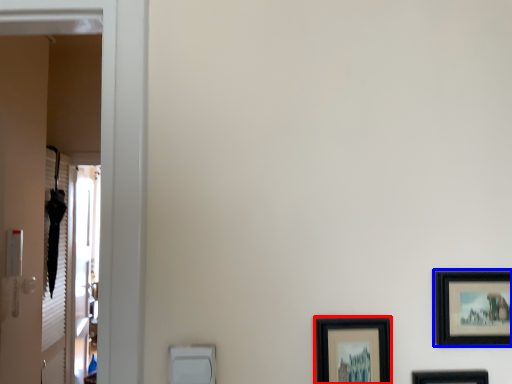
Question: Among these objects, which one is nearest to the camera, picture frame (highlighted by a red box) or picture frame (highlighted by a blue box)?

Choices:
 (A) picture frame
 (B) picture frame

Answer: (A)